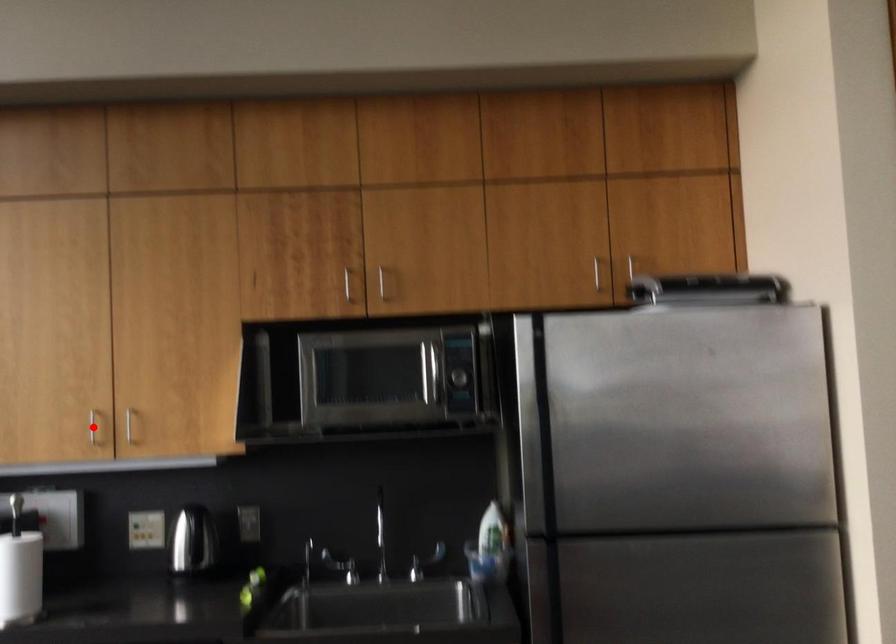
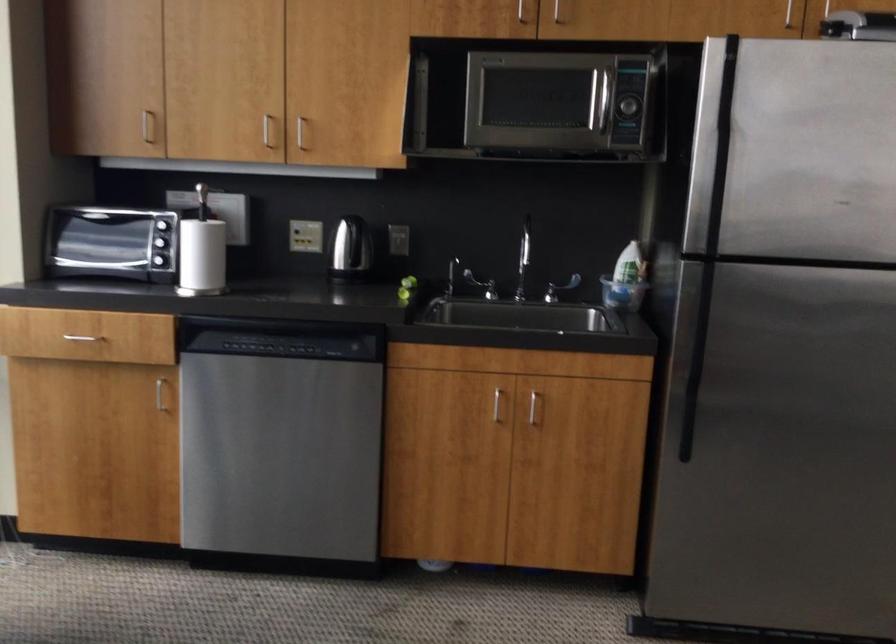
The point at the highlighted location is marked in the first image. Where is the corresponding point in the second image?

(266, 129)